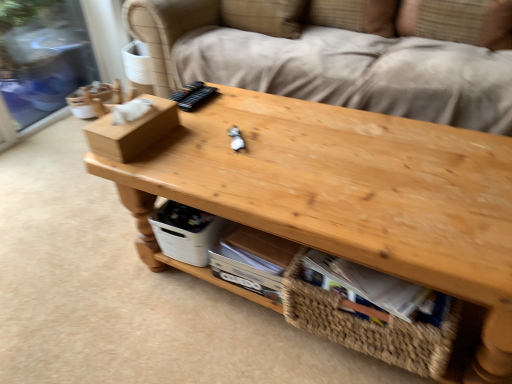
Question: Relative to brown cardboard box at left, is woven straw basket at lower center in front or behind?

Choices:
 (A) behind
 (B) front

Answer: (B)

Question: From a real-world perspective, is woven straw basket at lower center above or below brown cardboard box at left?

Choices:
 (A) below
 (B) above

Answer: (A)

Question: Estimate the real-world distances between objects in this image. Which object is farther from the natural wood table at center?

Choices:
 (A) brown cardboard box at left
 (B) white plastic storage box at lower center
 (C) woven straw basket at lower center

Answer: (A)

Question: Estimate the real-world distances between objects in this image. Which object is farther from the white plastic storage box at lower center?

Choices:
 (A) brown cardboard box at left
 (B) natural wood table at center
 (C) woven straw basket at lower center

Answer: (C)